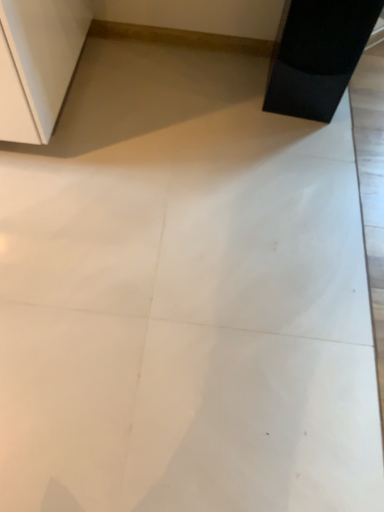
What are the coordinates of `free location in front of glossy black speaker at upper right` in the screenshot? It's located at (301, 143).